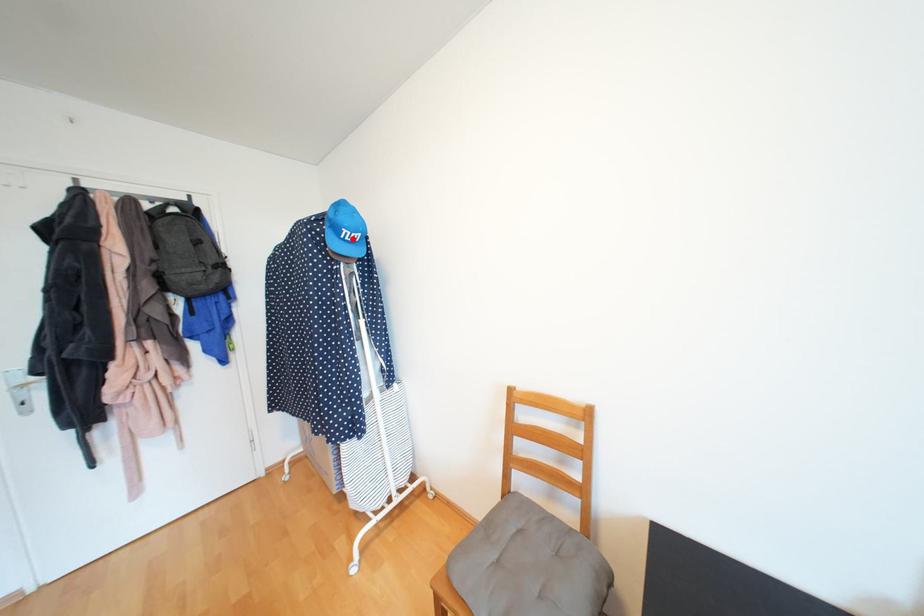
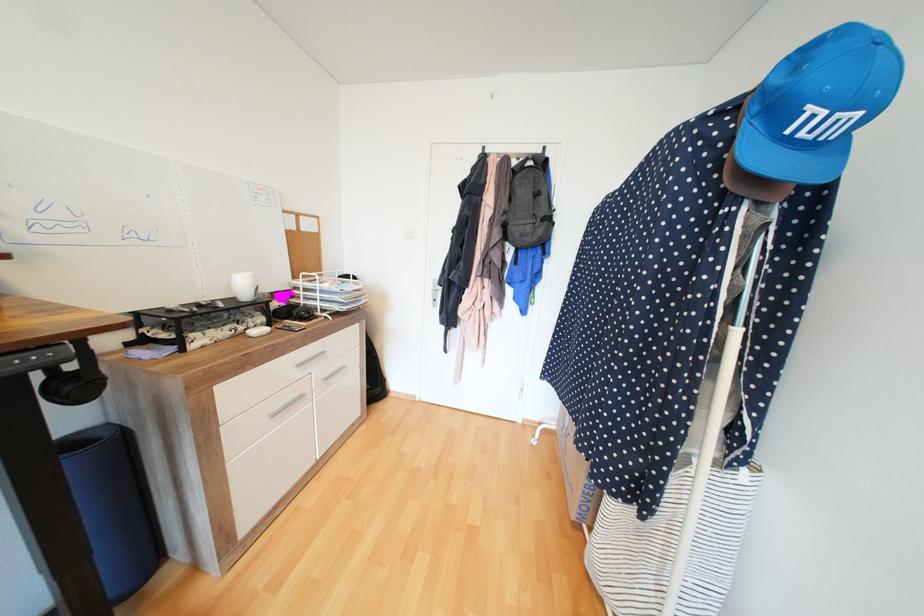
Find the pixel in the second image that matches the highlighted location in the first image.

(807, 134)